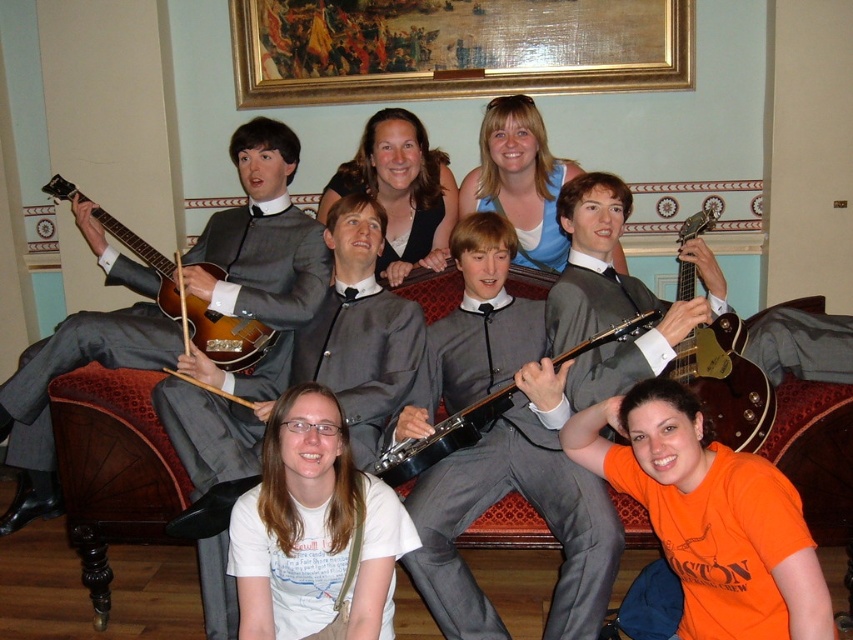
Question: Is matte black dress at upper center smaller than glossy wood guitar at upper right?

Choices:
 (A) yes
 (B) no

Answer: (A)

Question: Which point is farther from the camera taking this photo?

Choices:
 (A) (306, 632)
 (B) (489, 141)

Answer: (B)

Question: Is shiny silver guitar at left to the right of glossy wood guitar at center from the viewer's perspective?

Choices:
 (A) no
 (B) yes

Answer: (A)

Question: Where is matte gray suit at center located in relation to glossy wood guitar at upper right in the image?

Choices:
 (A) right
 (B) left

Answer: (B)

Question: Which object is the farthest from the matte black dress at upper center?

Choices:
 (A) matte gray suit at center
 (B) glossy wood guitar at center
 (C) shiny silver guitar at left
 (D) glossy wood guitar at upper right

Answer: (D)

Question: Which point is closer to the camera?

Choices:
 (A) (392, 339)
 (B) (526, 205)
 (C) (151, 253)
 (D) (683, 353)

Answer: (D)